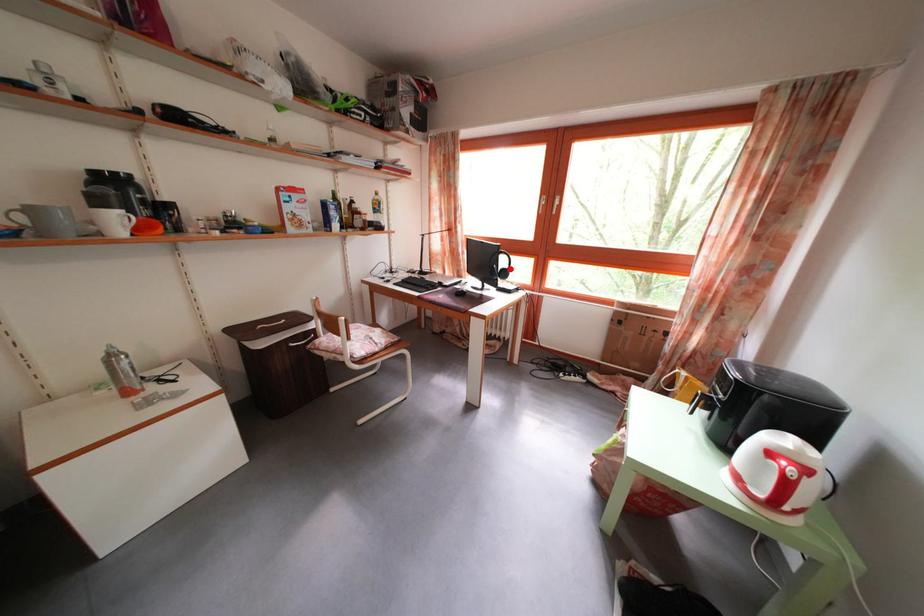
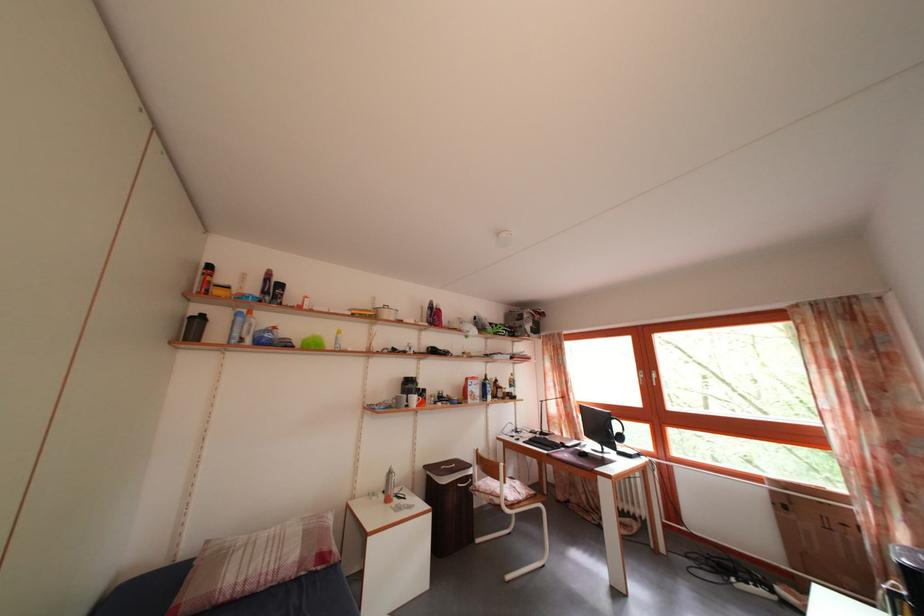
Question: I am providing you with two images of the same scene from different viewpoints. In image1, a red point is highlighted. Considering the same 3D point in image2, which of the following is correct?

Choices:
 (A) It is closer
 (B) It is farther

Answer: (B)